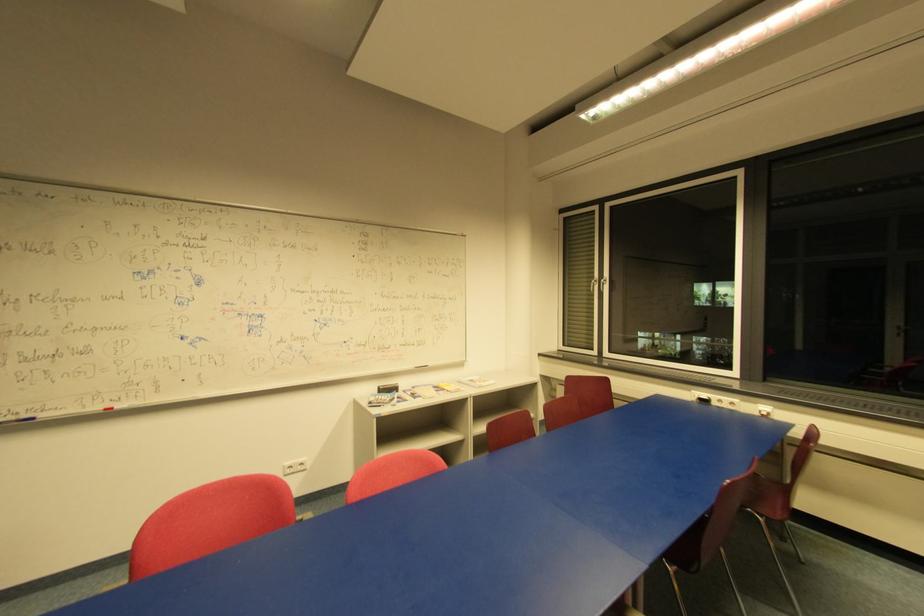
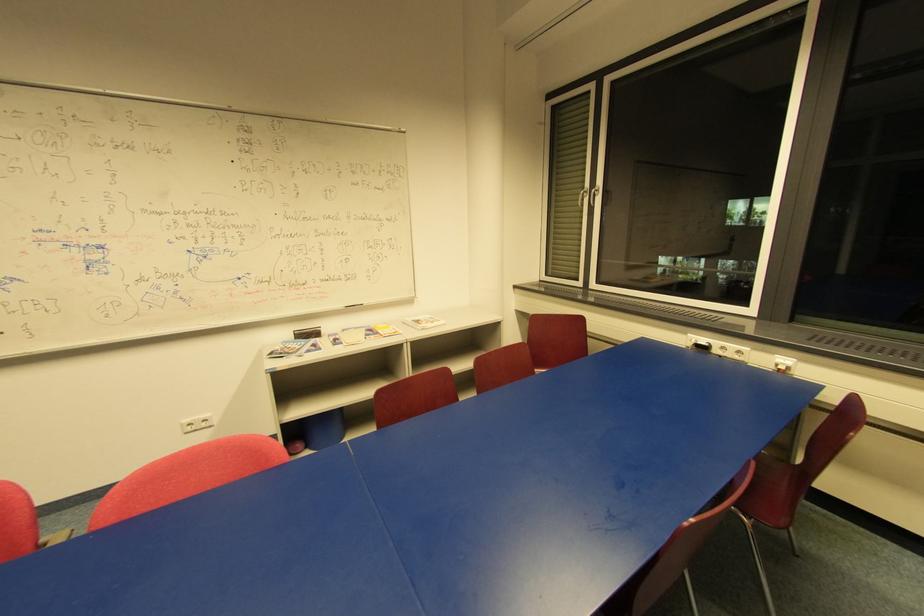
Locate, in the second image, the point that corresponds to [769,415] in the first image.

(785, 369)